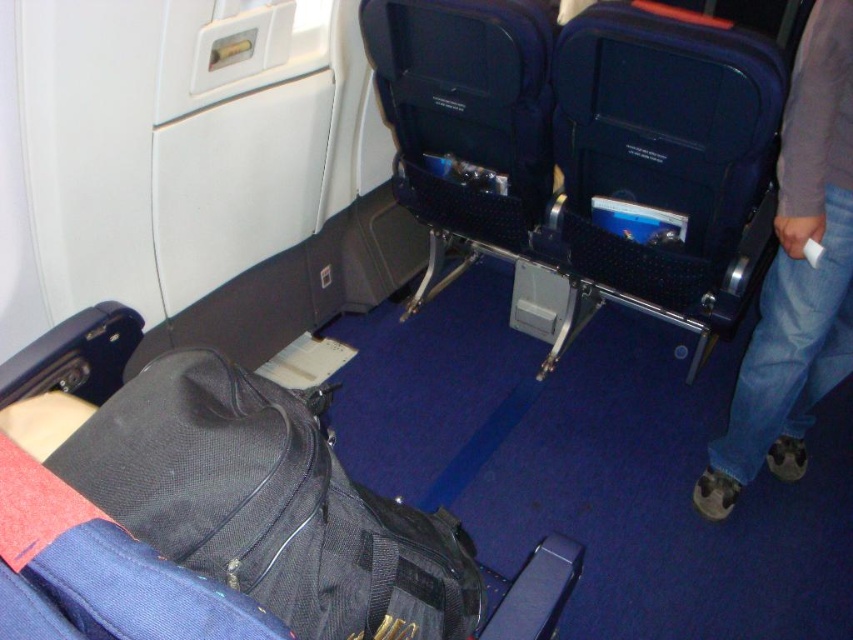
You are a flight attendant checking the airplane cabin. You need to retrieve an item located at point (x=268, y=504). What object is at that location?

The black mesh backpack at lower left is located at point (x=268, y=504).

You are a flight attendant carrying a 1 meter wide cart. You need to move from the front of the airplane to the back. Can you navigate through the space between the black mesh backpack at lower left and the jeans at right?

The distance between the black mesh backpack at lower left and the jeans at right is 1.01 meters, so the cart can pass through since it is slightly wider than the cart.

Looking at this image, you are seated in an airplane cabin and notice the black mesh backpack at lower left and the jeans at right. Which object is nearer to you?

The black mesh backpack at lower left is closer to the viewer than the jeans at right.